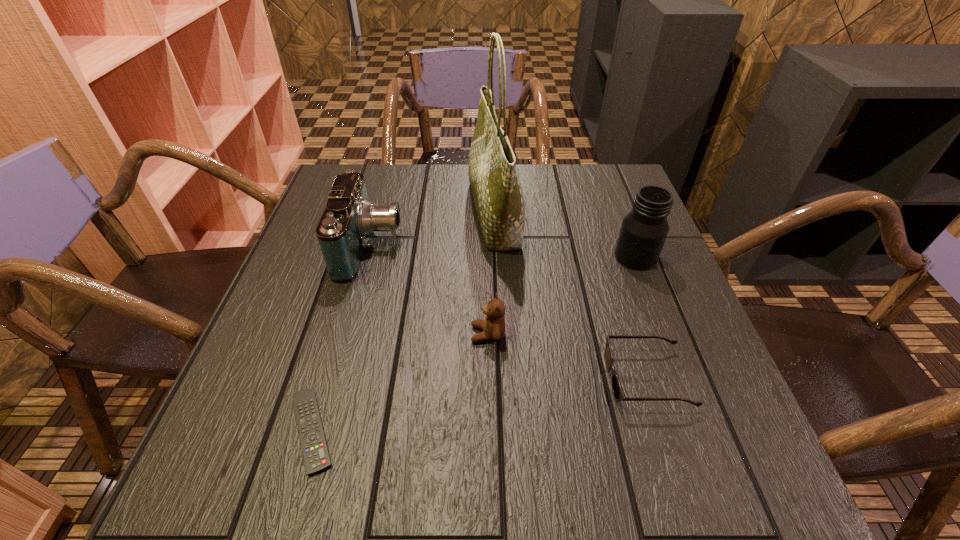
This screenshot has height=540, width=960. What are the coordinates of `vacant space located at the face of the teddy bear` in the screenshot? It's located at (308, 334).

You are a GUI agent. You are given a task and a screenshot of the screen. Output one action in this format:
    pyautogui.click(x=<x>, y=<y>)
    Task: Click on the free region located at the face of the teddy bear
    This screenshot has width=960, height=540.
    Given the screenshot: What is the action you would take?
    pyautogui.click(x=273, y=334)

Locate an element on the screen. This screenshot has width=960, height=540. free space located 0.270m on the front lenses of the sunglasses is located at coordinates (459, 379).

This screenshot has height=540, width=960. I want to click on vacant space situated 0.050m on the front lenses of the sunglasses, so click(581, 379).

You are a GUI agent. You are given a task and a screenshot of the screen. Output one action in this format:
    pyautogui.click(x=<x>, y=<y>)
    Task: Click on the vacant space located on the front lenses of the sunglasses
    The image size is (960, 540).
    Given the screenshot: What is the action you would take?
    pyautogui.click(x=497, y=379)

At what (x,y) coordinates should I click in order to perform the action: click on free location located 0.100m on the left of the remote control. Please return your answer as a coordinate pair (x, y). Looking at the image, I should click on (222, 431).

What are the coordinates of `object present at the far edge` in the screenshot? It's located at (497, 192).

Where is `object positioned at the near edge`? The width and height of the screenshot is (960, 540). object positioned at the near edge is located at coordinates (316, 456).

I want to click on camcorder situated at the left edge, so click(x=349, y=219).

This screenshot has width=960, height=540. Identify the location of remote control that is at the left edge. (316, 456).